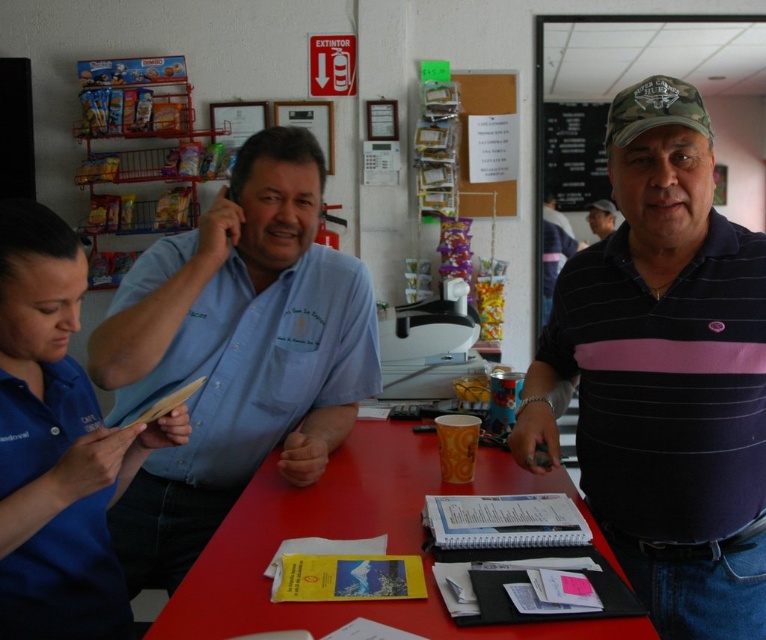
Question: Which object is the closest to the black striped polo shirt at right?

Choices:
 (A) red plastic table at center
 (B) black matte board at upper center

Answer: (A)

Question: Which object is closer to the camera taking this photo?

Choices:
 (A) matte black shirt at center
 (B) black striped polo shirt at right
 (C) black matte board at upper center
 (D) light blue shirt at left

Answer: (B)

Question: Does blue fabric shirt at upper left appear over red plastic table at center?

Choices:
 (A) yes
 (B) no

Answer: (A)

Question: Observing the image, what is the correct spatial positioning of red plastic table at center in reference to black matte board at upper center?

Choices:
 (A) left
 (B) right

Answer: (A)

Question: Is black matte board at upper center bigger than matte black shirt at center?

Choices:
 (A) yes
 (B) no

Answer: (A)

Question: Among these objects, which one is nearest to the camera?

Choices:
 (A) red plastic table at center
 (B) black striped polo shirt at right
 (C) matte black shirt at center

Answer: (A)